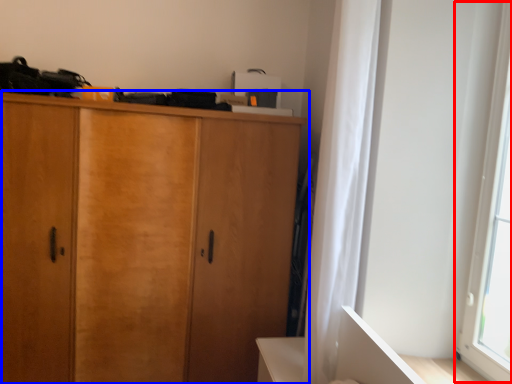
Question: Among these objects, which one is nearest to the camera, window screen (highlighted by a red box) or cupboard (highlighted by a blue box)?

Choices:
 (A) window screen
 (B) cupboard

Answer: (A)